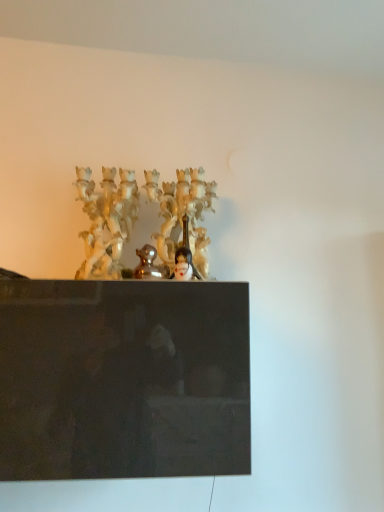
Question: Considering the relative sizes of smooth porcelain figurine at center and shiny gold duckling at center in the image provided, is smooth porcelain figurine at center taller than shiny gold duckling at center?

Choices:
 (A) no
 (B) yes

Answer: (A)

Question: Does smooth porcelain figurine at center contain shiny gold duckling at center?

Choices:
 (A) yes
 (B) no

Answer: (B)

Question: Is smooth porcelain figurine at center closer to the viewer compared to shiny gold duckling at center?

Choices:
 (A) no
 (B) yes

Answer: (A)

Question: From a real-world perspective, does smooth porcelain figurine at center stand above shiny gold duckling at center?

Choices:
 (A) yes
 (B) no

Answer: (B)

Question: Is smooth porcelain figurine at center outside shiny gold duckling at center?

Choices:
 (A) yes
 (B) no

Answer: (A)

Question: From a real-world perspective, is smooth porcelain figurine at center beneath shiny gold duckling at center?

Choices:
 (A) yes
 (B) no

Answer: (A)

Question: Is shiny gold duckling at center looking in the opposite direction of smooth porcelain figurine at center?

Choices:
 (A) yes
 (B) no

Answer: (B)

Question: Is shiny gold duckling at center oriented towards smooth porcelain figurine at center?

Choices:
 (A) yes
 (B) no

Answer: (B)

Question: Is shiny gold duckling at center beside smooth porcelain figurine at center?

Choices:
 (A) no
 (B) yes

Answer: (B)

Question: From the image's perspective, does shiny gold duckling at center appear lower than smooth porcelain figurine at center?

Choices:
 (A) no
 (B) yes

Answer: (A)

Question: From the image's perspective, is shiny gold duckling at center located above smooth porcelain figurine at center?

Choices:
 (A) no
 (B) yes

Answer: (B)

Question: Can you confirm if shiny gold duckling at center is bigger than smooth porcelain figurine at center?

Choices:
 (A) yes
 (B) no

Answer: (A)

Question: From a real-world perspective, is shiny gold duckling at center physically located above or below smooth porcelain figurine at center?

Choices:
 (A) above
 (B) below

Answer: (A)